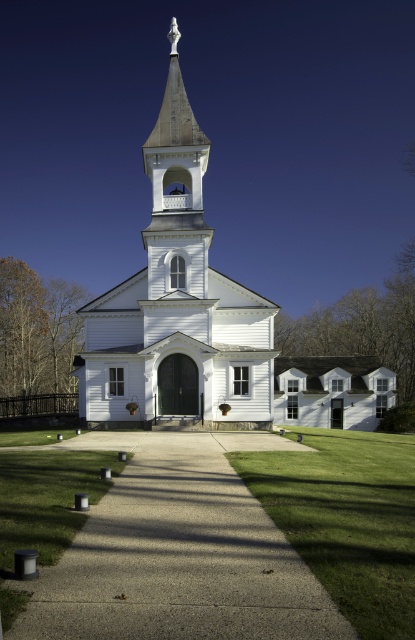
Does white wooden church at center appear over green grass at center?

Yes.

What are the coordinates of `white wooden church at center` in the screenshot? It's located at (177, 305).

Locate an element on the screen. This screenshot has height=640, width=415. white wooden church at center is located at coordinates (177, 305).

Find the location of a particular element. white wooden church at center is located at coordinates (177, 305).

Can you confirm if gray concrete path at center is shorter than white wooden church at center?

Yes, gray concrete path at center is shorter than white wooden church at center.

Who is more distant from viewer, (129, 573) or (175, 236)?

Point (175, 236)

Which is in front, point (234, 497) or point (266, 390)?

Point (234, 497)

Find the location of a particular element. This screenshot has height=640, width=415. gray concrete path at center is located at coordinates (178, 552).

Based on the photo, between gray concrete path at center and green grass at center, which one has less height?

gray concrete path at center is shorter.

What do you see at coordinates (178, 552) in the screenshot?
I see `gray concrete path at center` at bounding box center [178, 552].

Identify the location of gray concrete path at center. The image size is (415, 640). (178, 552).